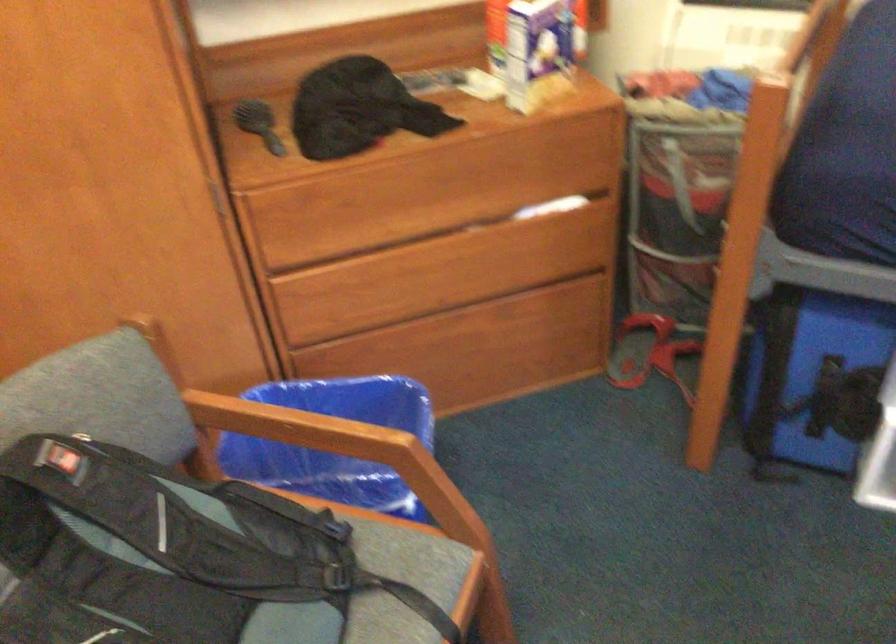
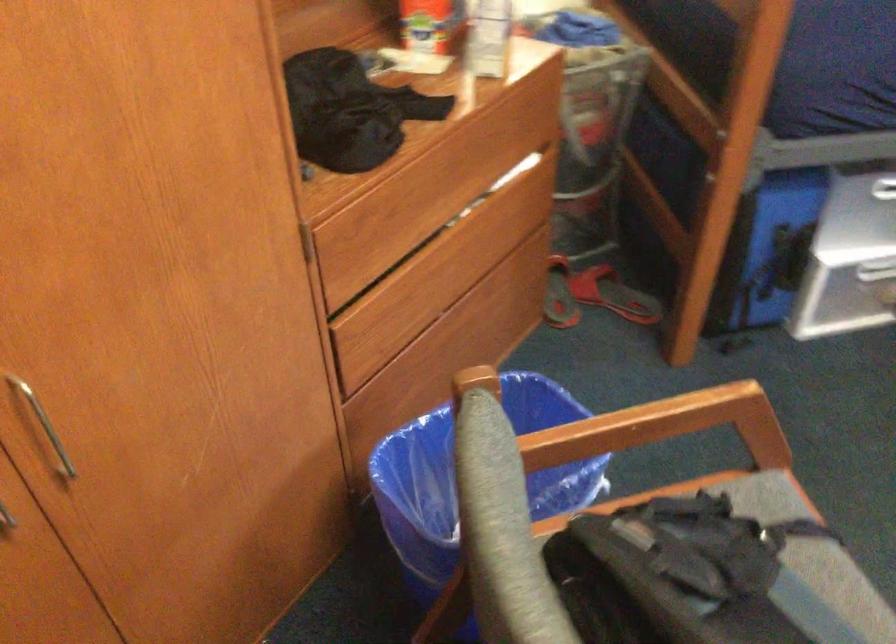
Locate, in the second image, the point that corresponds to point (444, 574) in the first image.

(769, 504)